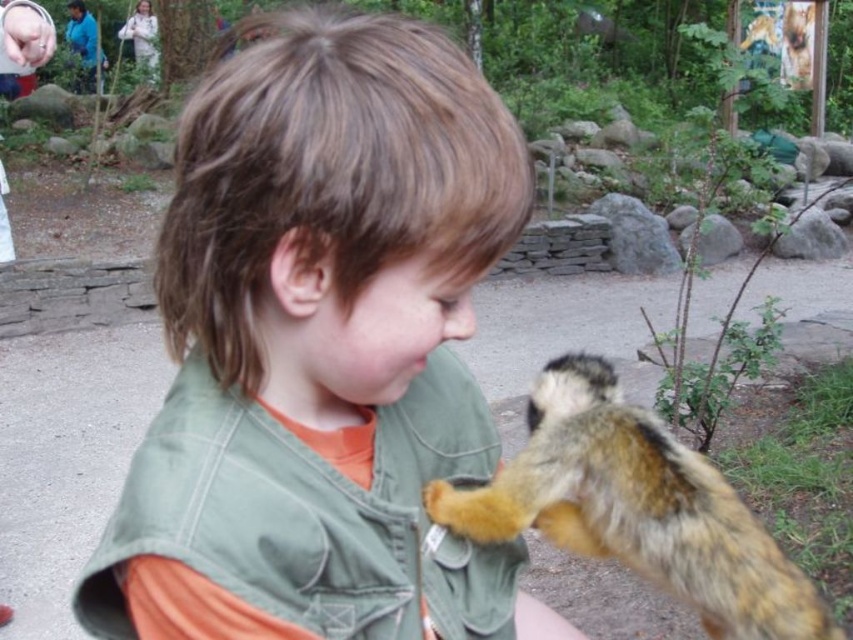
The user is a zookeeper who needs to determine the best path to retrieve a snack from a nearby cart without blocking the view of the visitors watching the interaction between the green fabric shirt at center and the fuzzy brown squirrel at lower right. Which object should the zookeeper move around to keep the view clear?

The green fabric shirt at center is in front of the fuzzy brown squirrel at lower right, so the zookeeper should move around the green fabric shirt at center to avoid blocking the visitors view.

The user is a zookeeper who needs to determine the best way to approach the green fabric shirt at center and the fuzzy brown squirrel at lower right. Based on their positions, which object is higher up?

The green fabric shirt at center is above the fuzzy brown squirrel at lower right, so the green fabric shirt at center is higher up.

You are a zookeeper who needs to place a 20 cm long feeding tray between the green fabric shirt at center and the fuzzy brown squirrel at lower right. Can the tray fit in the space between them?

The distance between the green fabric shirt at center and the fuzzy brown squirrel at lower right is 17.56 centimeters. Since the feeding tray is 20 cm long, it cannot fit in the space between them as the tray is longer than the available distance.